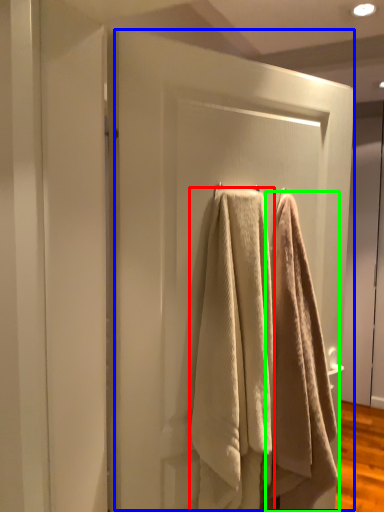
Question: Estimate the real-world distances between objects in this image. Which object is closer to towel (highlighted by a red box), screen door (highlighted by a blue box) or towel (highlighted by a green box)?

Choices:
 (A) screen door
 (B) towel

Answer: (B)